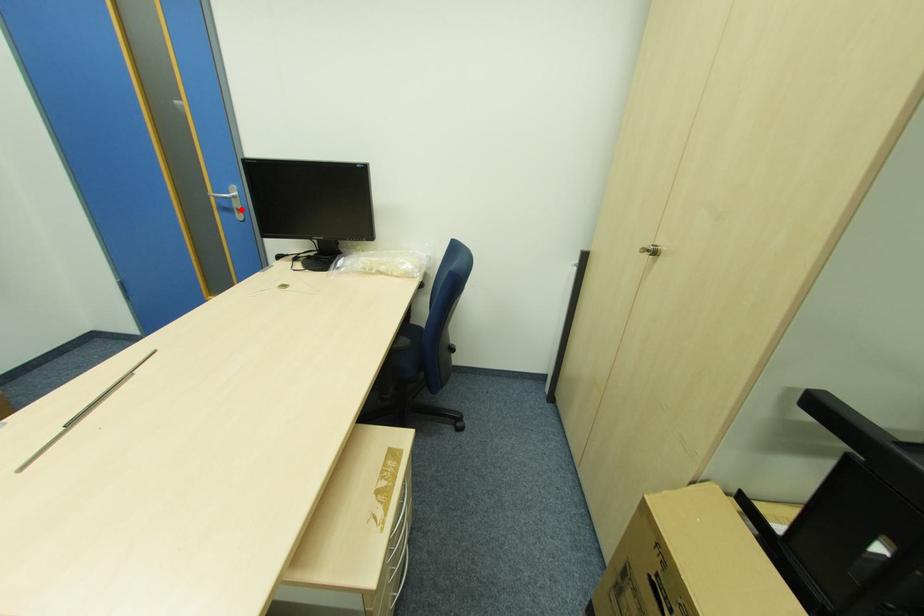
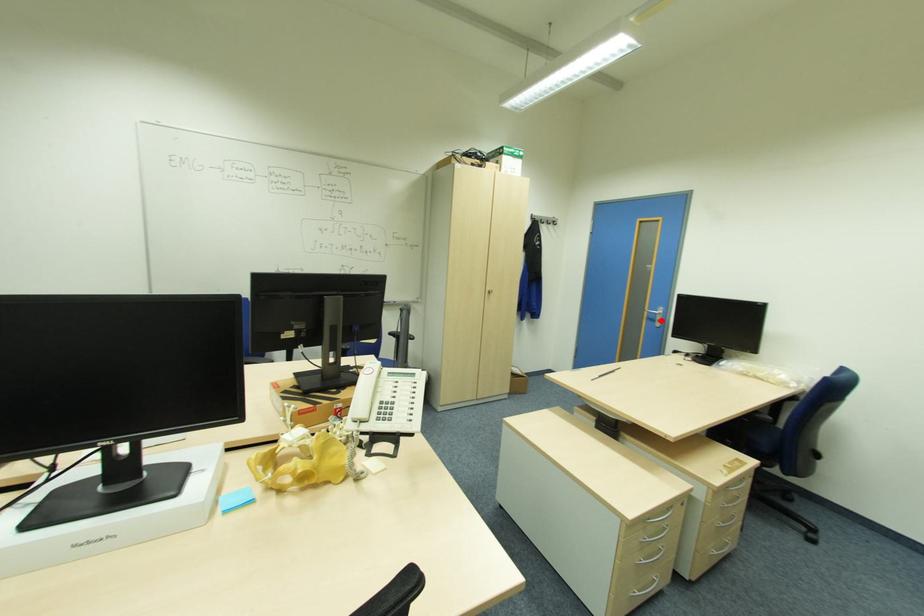
I am providing you with two images of the same scene from different viewpoints. A red point is marked on the first image and another point is marked on the second image. Do the highlighted points in image1 and image2 indicate the same real-world spot?

Yes